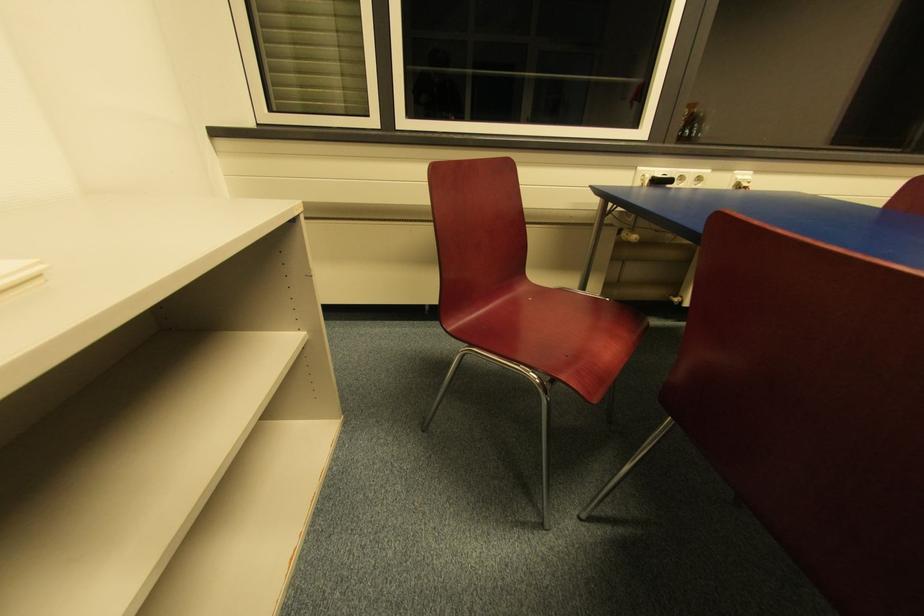
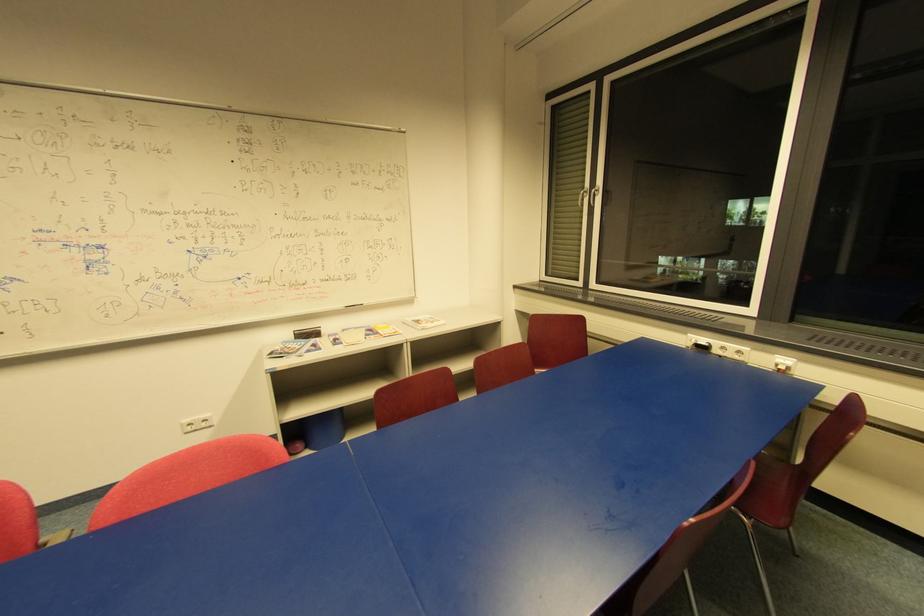
Where in the second image is the point corresponding to pixel 676 185 from the first image?

(720, 352)